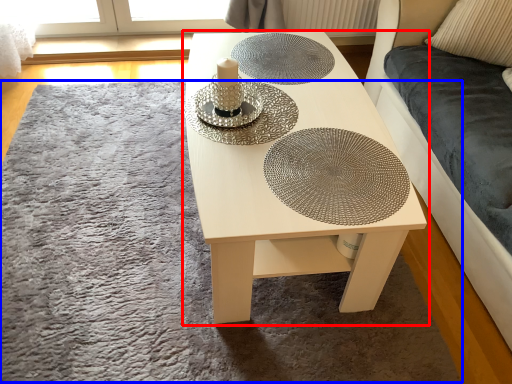
Question: Which object appears farthest to the camera in this image, table (highlighted by a red box) or mat (highlighted by a blue box)?

Choices:
 (A) table
 (B) mat

Answer: (B)